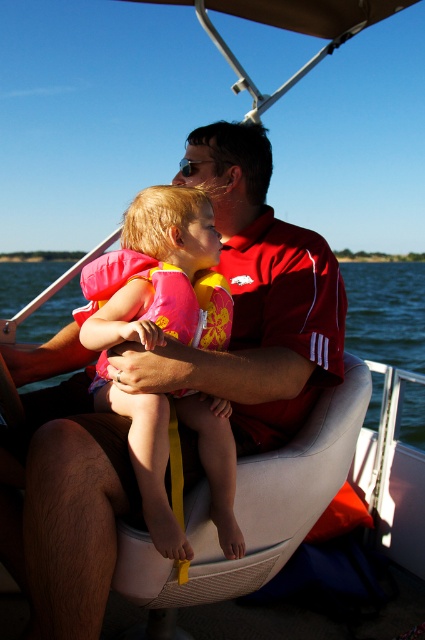
Can you confirm if pink life vest at center is smaller than pink fabric life jacket at center?

Actually, pink life vest at center might be larger than pink fabric life jacket at center.

Is point (178, 205) closer to camera compared to point (115, 284)?

No, (178, 205) is further to viewer.

The image size is (425, 640). What do you see at coordinates (155, 332) in the screenshot? I see `pink life vest at center` at bounding box center [155, 332].

At what (x,y) coordinates should I click in order to perform the action: click on pink life vest at center. Please return your answer as a coordinate pair (x, y). The height and width of the screenshot is (640, 425). Looking at the image, I should click on [x=155, y=332].

What are the coordinates of `pink life vest at center` in the screenshot? It's located at (155, 332).

Is pink life vest at center wider than blue water at center?

No.

Which is behind, point (153, 196) or point (17, 305)?

Positioned behind is point (17, 305).

At what (x,y) coordinates should I click in order to perform the action: click on pink life vest at center. Please return your answer as a coordinate pair (x, y). Looking at the image, I should click on (155, 332).

Can you confirm if blue water at center is thinner than pink fabric life jacket at center?

No.

Does blue water at center have a greater width compared to pink fabric life jacket at center?

Correct, the width of blue water at center exceeds that of pink fabric life jacket at center.

Which is in front, point (411, 426) or point (169, 308)?

Point (169, 308)

Find the location of a particular element. The height and width of the screenshot is (640, 425). blue water at center is located at coordinates (385, 312).